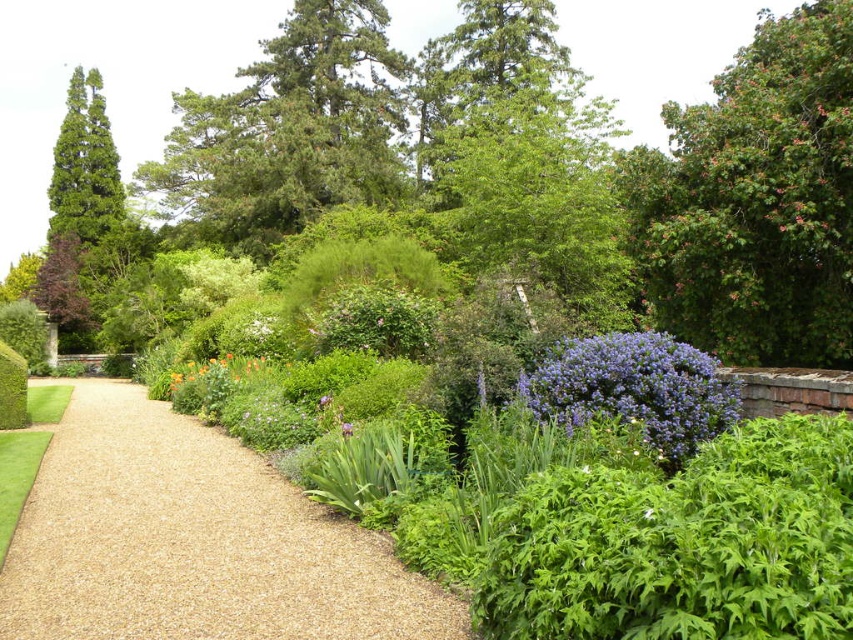
Question: Is brown gravel path at center positioned before orange matte flower at center?

Choices:
 (A) no
 (B) yes

Answer: (B)

Question: Which of the following is the closest to the observer?

Choices:
 (A) white fluffy flower at center
 (B) purple matte bush at center-right

Answer: (B)

Question: Estimate the real-world distances between objects in this image. Which object is closer to the brown gravel path at center?

Choices:
 (A) purple matte bush at center-right
 (B) purple matte flower at center
 (C) orange matte flower at center

Answer: (B)

Question: Does green leafy tree at upper right have a larger size compared to green needle-like at upper center?

Choices:
 (A) no
 (B) yes

Answer: (B)

Question: Is purple matte bush at center-right below purple matte flower at center?

Choices:
 (A) no
 (B) yes

Answer: (A)

Question: Estimate the real-world distances between objects in this image. Which object is closer to the purple matte bush at center-right?

Choices:
 (A) green needle-like at upper center
 (B) green leafy tree at upper right

Answer: (B)